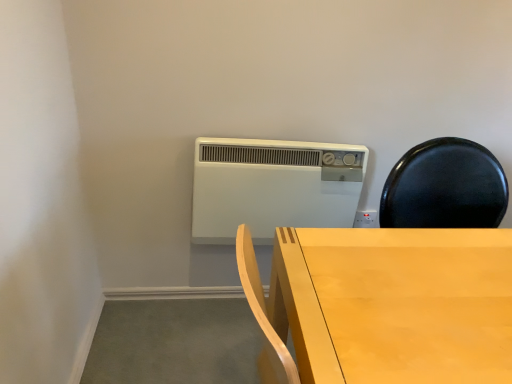
What do you see at coordinates (395, 304) in the screenshot? I see `light wood table at center` at bounding box center [395, 304].

At what (x,y) coordinates should I click in order to perform the action: click on light wood table at center. Please return your answer as a coordinate pair (x, y). Looking at the image, I should click on (395, 304).

Measure the distance between point (505, 274) and camera.

They are 87.50 centimeters apart.

Identify the location of white plastic heater at upper center. The width and height of the screenshot is (512, 384). (272, 187).

The height and width of the screenshot is (384, 512). What do you see at coordinates (272, 187) in the screenshot?
I see `white plastic heater at upper center` at bounding box center [272, 187].

In order to face white plastic heater at upper center, should I rotate leftwards or rightwards?

Rotate your view right by about 2.864°.

You are a GUI agent. You are given a task and a screenshot of the screen. Output one action in this format:
    pyautogui.click(x=<x>, y=<y>)
    Task: Click on the light wood table at center
    The height and width of the screenshot is (384, 512).
    Given the screenshot: What is the action you would take?
    pyautogui.click(x=395, y=304)

Considering the positions of objects light wood table at center and white plastic heater at upper center in the image provided, who is more to the left, light wood table at center or white plastic heater at upper center?

white plastic heater at upper center is more to the left.

Which object is more forward, light wood table at center or white plastic heater at upper center?

light wood table at center.

Which point is more distant from viewer, (x=481, y=288) or (x=222, y=190)?

The point (x=222, y=190) is behind.

From the picture: From the image's perspective, is light wood table at center positioned above or below white plastic heater at upper center?

light wood table at center is below white plastic heater at upper center.

From a real-world perspective, which object stands above the other?

light wood table at center is physically above.

Which object is thinner, light wood table at center or white plastic heater at upper center?

With smaller width is white plastic heater at upper center.

Which of these two, light wood table at center or white plastic heater at upper center, stands shorter?

white plastic heater at upper center.

Who is smaller, light wood table at center or white plastic heater at upper center?

With smaller size is white plastic heater at upper center.

Is light wood table at center inside the boundaries of white plastic heater at upper center, or outside?

light wood table at center is outside white plastic heater at upper center.

Is light wood table at center placed right next to white plastic heater at upper center?

They are not placed beside each other.

Is light wood table at center oriented towards white plastic heater at upper center?

No, light wood table at center is not aimed at white plastic heater at upper center.

Find the location of a particular element. This screenshot has width=512, height=384. home appliance lying above the light wood table at center (from the image's perspective) is located at coordinates (272, 187).

Looking at this image, considering the relative positions of white plastic heater at upper center and light wood table at center in the image provided, is white plastic heater at upper center to the right of light wood table at center from the viewer's perspective?

No, white plastic heater at upper center is not to the right of light wood table at center.

Is white plastic heater at upper center in front of light wood table at center?

No, it is not.

Between point (335, 202) and point (375, 234), which one is positioned in front?

Point (375, 234)

From the image's perspective, is white plastic heater at upper center located above light wood table at center?

Indeed, from the image's perspective, white plastic heater at upper center is shown above light wood table at center.

From a real-world perspective, who is located higher, white plastic heater at upper center or light wood table at center?

light wood table at center, from a real-world perspective.

Considering the sizes of objects white plastic heater at upper center and light wood table at center in the image provided, who is thinner, white plastic heater at upper center or light wood table at center?

With smaller width is white plastic heater at upper center.

Considering the relative sizes of white plastic heater at upper center and light wood table at center in the image provided, is white plastic heater at upper center shorter than light wood table at center?

Yes.

Looking at the image, does white plastic heater at upper center seem bigger or smaller compared to light wood table at center?

Clearly, white plastic heater at upper center is smaller in size than light wood table at center.

Choose the correct answer: Is white plastic heater at upper center inside light wood table at center or outside it?

The correct answer is: outside.

Are white plastic heater at upper center and light wood table at center making contact?

No, white plastic heater at upper center is not with light wood table at center.

Is white plastic heater at upper center positioned with its back to light wood table at center?

No, white plastic heater at upper center's orientation is not away from light wood table at center.

How many degrees apart are the facing directions of white plastic heater at upper center and light wood table at center?

white plastic heater at upper center and light wood table at center are facing 91.5 degrees away from each other.

Find the location of a particular element. The width and height of the screenshot is (512, 384). home appliance that appears below the light wood table at center (from a real-world perspective) is located at coordinates (272, 187).

Where is `home appliance behind the light wood table at center`? home appliance behind the light wood table at center is located at coordinates (272, 187).

You are a GUI agent. You are given a task and a screenshot of the screen. Output one action in this format:
    pyautogui.click(x=<x>, y=<y>)
    Task: Click on the home appliance that is under the light wood table at center (from a real-world perspective)
    The image size is (512, 384).
    Given the screenshot: What is the action you would take?
    pyautogui.click(x=272, y=187)